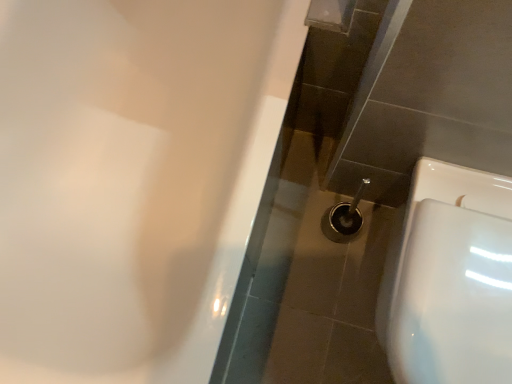
Question: Does white glossy toilet at lower right turn towards white glossy bathtub at upper left?

Choices:
 (A) yes
 (B) no

Answer: (B)

Question: Does white glossy toilet at lower right appear on the left side of white glossy bathtub at upper left?

Choices:
 (A) no
 (B) yes

Answer: (A)

Question: From the image's perspective, is white glossy toilet at lower right above white glossy bathtub at upper left?

Choices:
 (A) no
 (B) yes

Answer: (A)

Question: Is white glossy toilet at lower right to the right of white glossy bathtub at upper left from the viewer's perspective?

Choices:
 (A) no
 (B) yes

Answer: (B)

Question: Considering the relative sizes of white glossy toilet at lower right and white glossy bathtub at upper left in the image provided, is white glossy toilet at lower right taller than white glossy bathtub at upper left?

Choices:
 (A) no
 (B) yes

Answer: (A)

Question: From a real-world perspective, is white glossy toilet at lower right on top of white glossy bathtub at upper left?

Choices:
 (A) yes
 (B) no

Answer: (B)

Question: From the image's perspective, is white glossy bathtub at upper left under white glossy toilet at lower right?

Choices:
 (A) yes
 (B) no

Answer: (B)

Question: Can you see white glossy bathtub at upper left touching white glossy toilet at lower right?

Choices:
 (A) yes
 (B) no

Answer: (B)

Question: Does white glossy bathtub at upper left have a larger size compared to white glossy toilet at lower right?

Choices:
 (A) yes
 (B) no

Answer: (A)

Question: From the image's perspective, is white glossy bathtub at upper left on white glossy toilet at lower right?

Choices:
 (A) yes
 (B) no

Answer: (A)

Question: Could you tell me if white glossy bathtub at upper left is facing white glossy toilet at lower right?

Choices:
 (A) yes
 (B) no

Answer: (B)

Question: Considering the relative positions of white glossy bathtub at upper left and white glossy toilet at lower right in the image provided, is white glossy bathtub at upper left to the left of white glossy toilet at lower right from the viewer's perspective?

Choices:
 (A) yes
 (B) no

Answer: (A)

Question: From their relative heights in the image, would you say white glossy toilet at lower right is taller or shorter than white glossy bathtub at upper left?

Choices:
 (A) tall
 (B) short

Answer: (B)